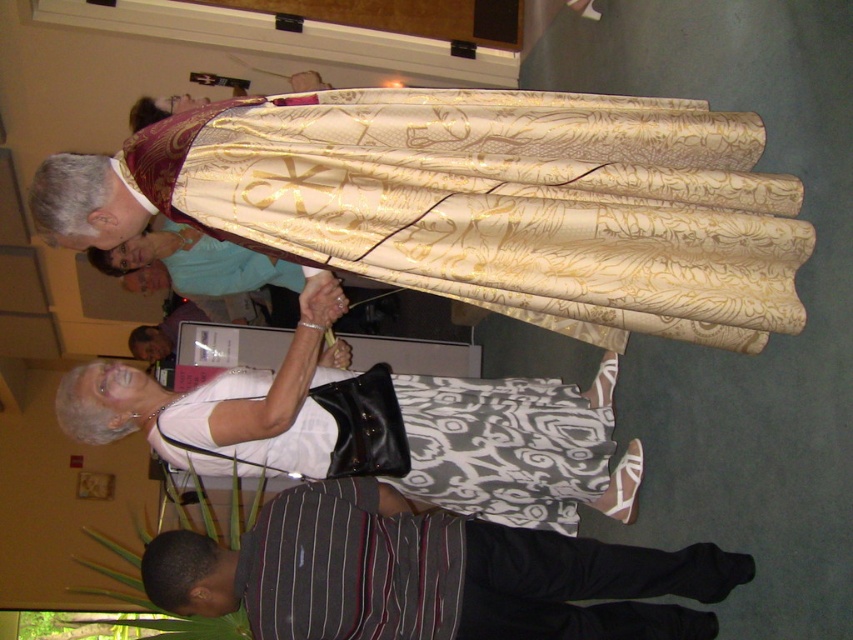
In the scene shown: Which is more to the right, striped cotton shirt at lower center or striped cotton shirt at center?

From the viewer's perspective, striped cotton shirt at lower center appears more on the right side.

Which is below, striped cotton shirt at lower center or striped cotton shirt at center?

striped cotton shirt at lower center is lower down.

Identify the location of striped cotton shirt at lower center. (428, 573).

Locate an element on the screen. striped cotton shirt at lower center is located at coordinates (428, 573).